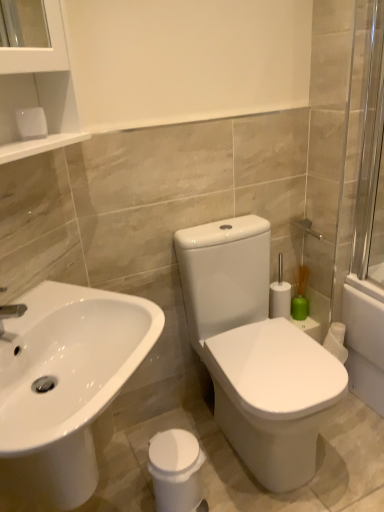
Question: Is point (66, 328) closer or farther from the camera than point (0, 320)?

Choices:
 (A) farther
 (B) closer

Answer: (A)

Question: Relative to silver metallic tap at left, is white glossy sink at lower left in front or behind?

Choices:
 (A) behind
 (B) front

Answer: (B)

Question: Which of these objects is positioned closest to the white glossy sink at lower left?

Choices:
 (A) white glossy trash can at lower center
 (B) transparent glass screen door at right
 (C) green matte vase at right
 (D) silver metallic tap at left

Answer: (D)

Question: Estimate the real-world distances between objects in this image. Which object is farther from the white glossy trash can at lower center?

Choices:
 (A) green matte vase at right
 (B) silver metallic tap at left
 (C) white glossy sink at lower left
 (D) transparent glass screen door at right

Answer: (D)